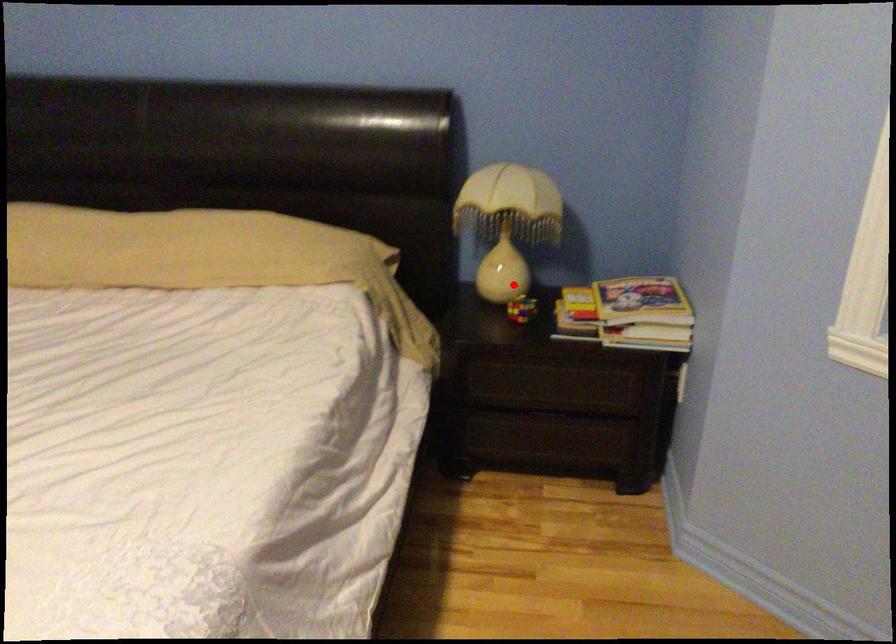
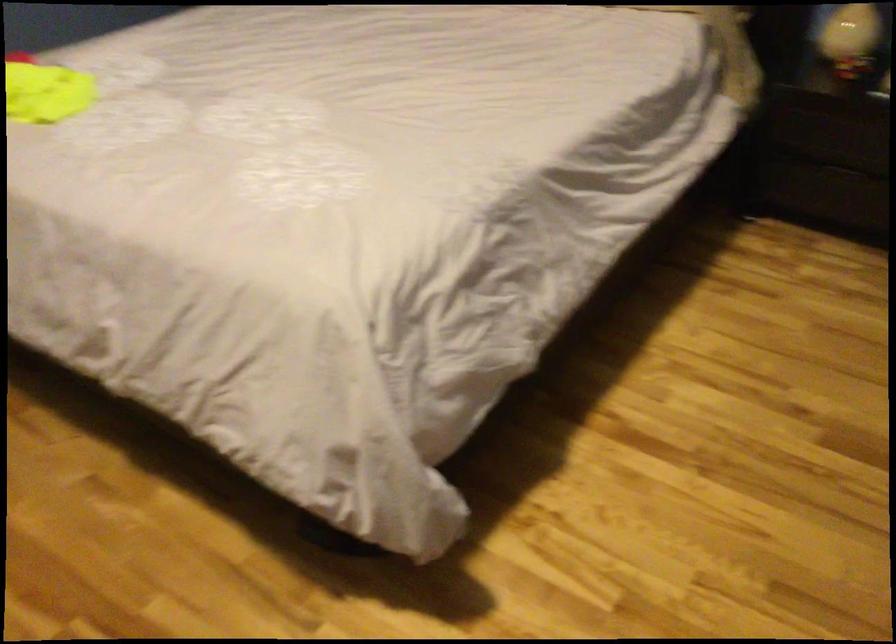
Question: I am providing you with two images of the same scene from different viewpoints. A red point is marked on the first image. Can you still see the location of the red point in image 2?

Choices:
 (A) Yes
 (B) No

Answer: (A)